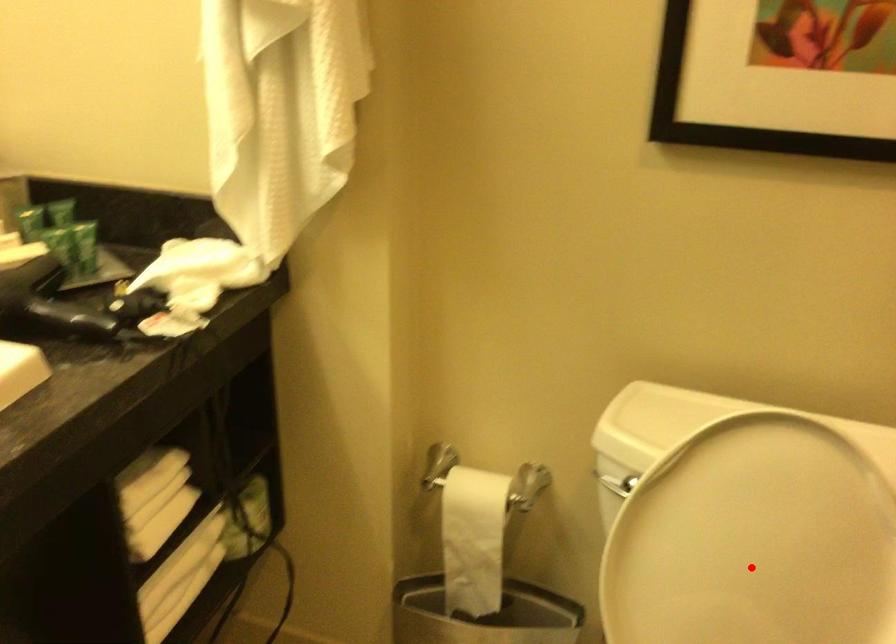
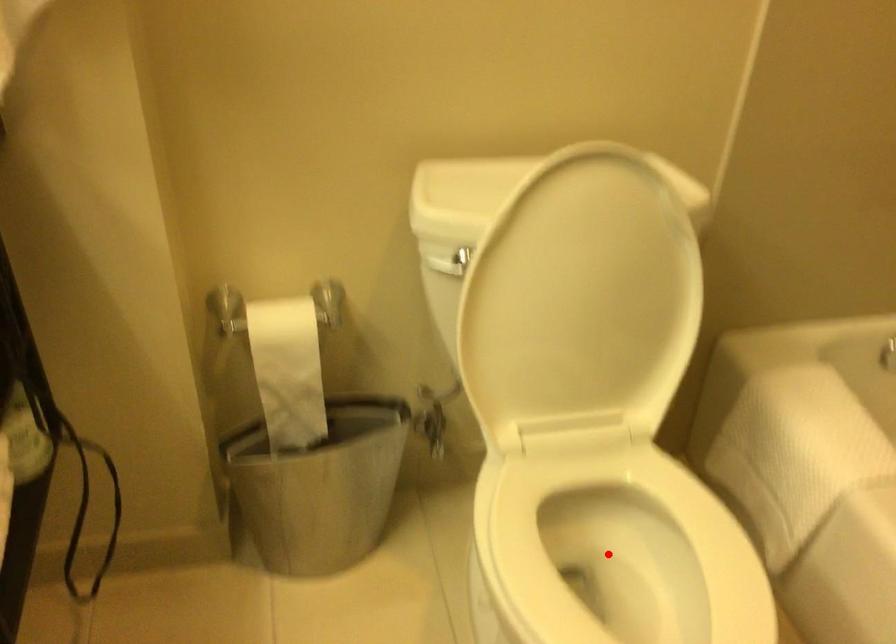
I am providing you with two images of the same scene from different viewpoints. A red point is marked on the first image and another point is marked on the second image. Is the red point in image1 aligned with the point shown in image2?

No